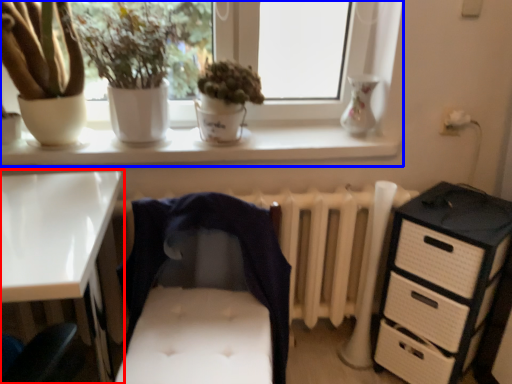
Question: Which point is further to the camera, desk (highlighted by a red box) or window (highlighted by a blue box)?

Choices:
 (A) desk
 (B) window

Answer: (B)